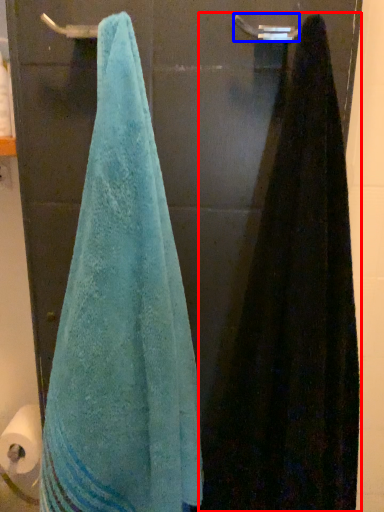
Question: Which object appears farthest to the camera in this image, towel (highlighted by a red box) or towel bar (highlighted by a blue box)?

Choices:
 (A) towel
 (B) towel bar

Answer: (B)